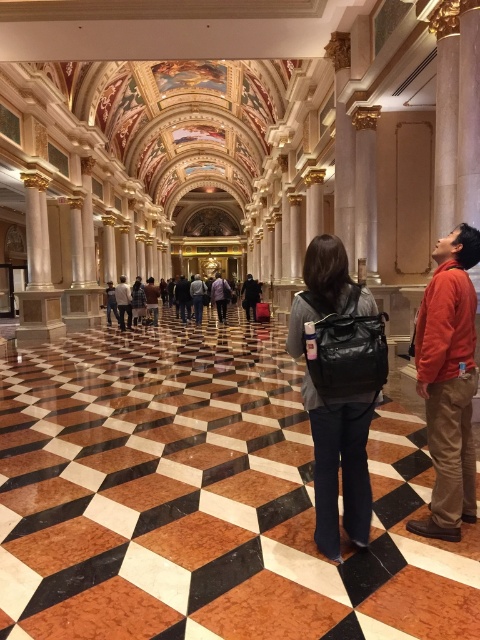
You are standing in the grand hallway and want to walk from point A to point B. Point A is located at coordinates point (415, 353) and point B is at point (222, 292). Which direction should you move to reach point B from point A?

To reach point B from point A, you should move backward since point A is in front of point B according to their coordinates.

You are standing in the hallway and need to reach the exit located behind the two people. Which object should you move around to avoid bumping into them? The matte black backpack at center or the black leather coat at center?

The matte black backpack at center is positioned on the right side of black leather coat at center. To avoid bumping into them, you should move around the black leather coat at center since it is on the left side, allowing you to navigate around the right side of the group.